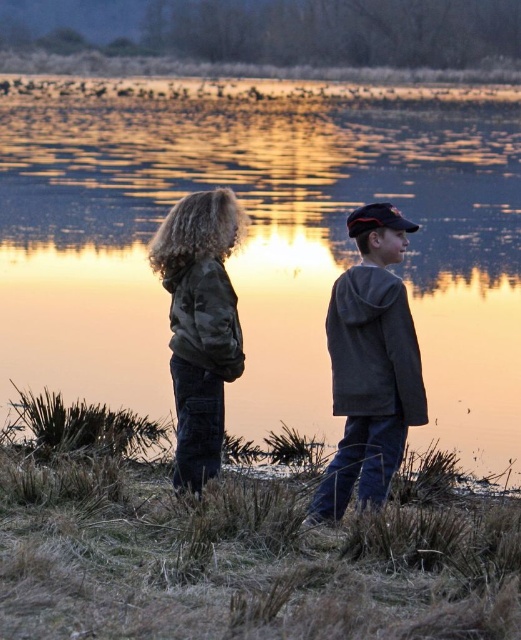
Question: Does gray fleece jacket at center have a greater width compared to camo jacket at center?

Choices:
 (A) yes
 (B) no

Answer: (A)

Question: Which point is farther to the camera?

Choices:
 (A) gray fleece jacket at center
 (B) camouflage jacket at center
 (C) camo jacket at center

Answer: (B)

Question: From the image, what is the correct spatial relationship of gray fleece jacket at center in relation to camo jacket at center?

Choices:
 (A) left
 (B) right

Answer: (B)

Question: Is glistening water at center to the right of camouflage jacket at center from the viewer's perspective?

Choices:
 (A) no
 (B) yes

Answer: (A)

Question: Which point is closer to the camera?

Choices:
 (A) (197, 321)
 (B) (179, 429)
 (C) (393, 368)

Answer: (A)

Question: Which point is closer to the camera?

Choices:
 (A) (339, 276)
 (B) (102, 346)
 (C) (232, 342)
 (D) (356, 228)

Answer: (C)